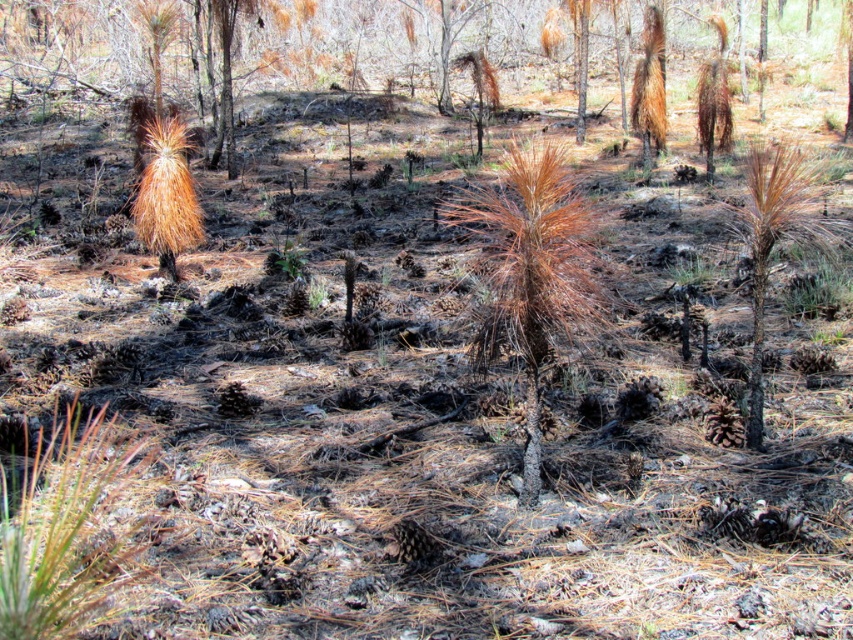
Question: Which point is farther to the camera?

Choices:
 (A) (761, 435)
 (B) (543, 189)

Answer: (A)

Question: Does brown/dry pine tree at center appear under brown/dried wood tree at center?

Choices:
 (A) yes
 (B) no

Answer: (B)

Question: Is brown/dry pine tree at center positioned before brown/dried wood tree at center?

Choices:
 (A) no
 (B) yes

Answer: (B)

Question: Is brown/dry pine tree at center below brown/dried wood tree at center?

Choices:
 (A) no
 (B) yes

Answer: (A)